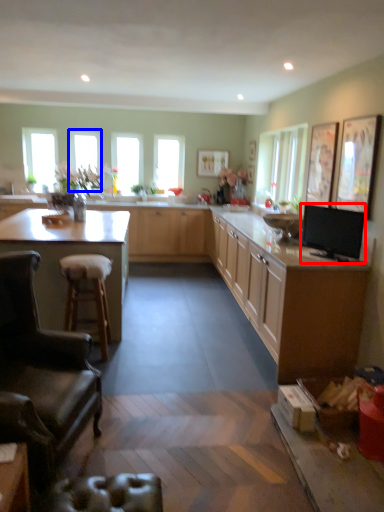
Question: Which point is closer to the camera, appliance (highlighted by a red box) or window (highlighted by a blue box)?

Choices:
 (A) appliance
 (B) window

Answer: (A)